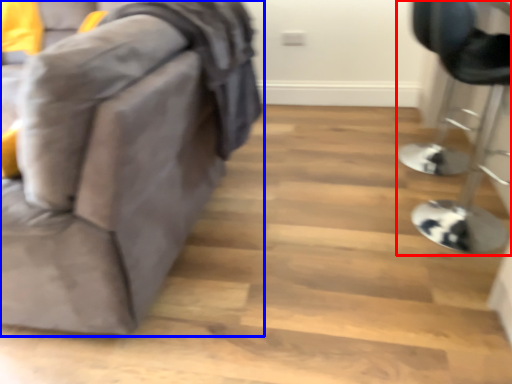
Question: Among these objects, which one is farthest to the camera, furniture (highlighted by a red box) or furniture (highlighted by a blue box)?

Choices:
 (A) furniture
 (B) furniture

Answer: (A)